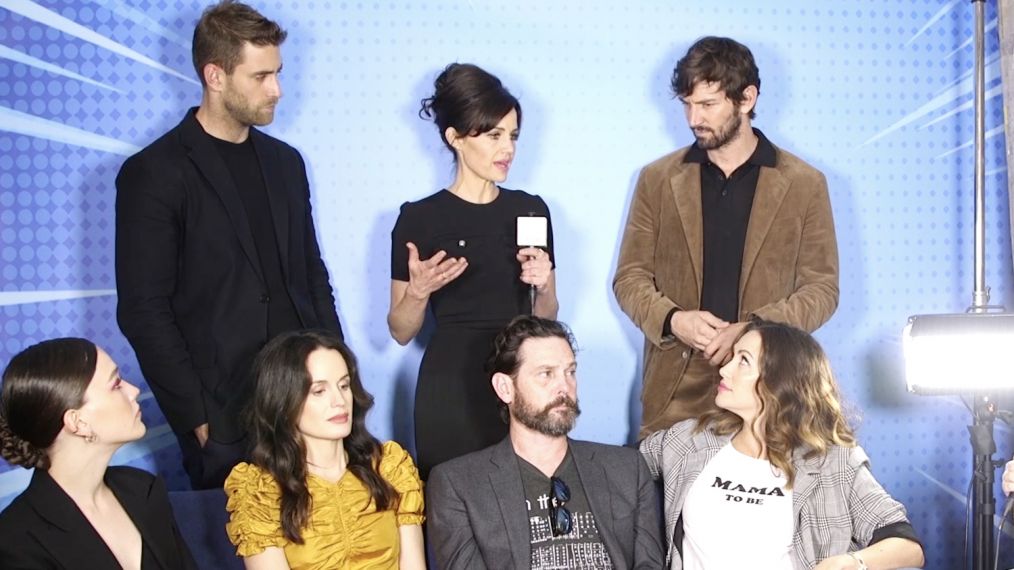
This screenshot has height=570, width=1014. Identify the location of light. (955, 352).